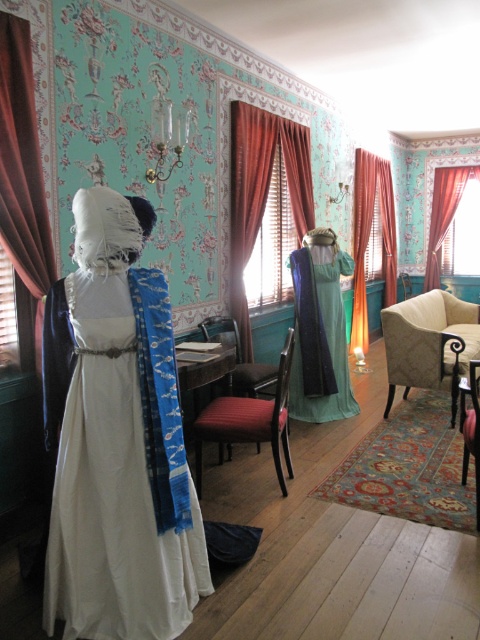
Can you confirm if velvet burgundy curtain at center is taller than velvet burgundy chair at center?

Yes.

At what (x,y) coordinates should I click in order to perform the action: click on velvet burgundy curtain at center. Please return your answer as a coordinate pair (x, y). The height and width of the screenshot is (640, 480). Looking at the image, I should click on (262, 193).

Based on the photo, is velvet dark red curtain at left further to the viewer compared to velvet burgundy chair at center?

No, it is in front of velvet burgundy chair at center.

Is velvet dark red curtain at left wider than velvet burgundy chair at center?

No.

Describe the element at coordinates (23, 172) in the screenshot. I see `velvet dark red curtain at left` at that location.

Locate an element on the screen. The image size is (480, 640). velvet dark red curtain at left is located at coordinates (23, 172).

Can you confirm if white satin dress at left is taller than velvet curtain at right?

No, white satin dress at left is not taller than velvet curtain at right.

Measure the distance between white satin dress at left and velvet curtain at right.

The distance of white satin dress at left from velvet curtain at right is 22.28 feet.

Does point (48, 593) lie in front of point (456, 205)?

Yes, point (48, 593) is in front of point (456, 205).

The image size is (480, 640). I want to click on white satin dress at left, so tap(115, 520).